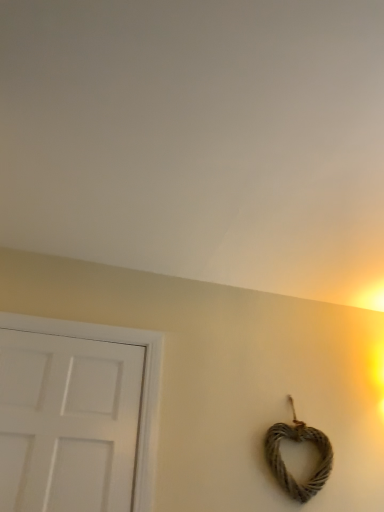
Question: From a real-world perspective, is rustic brown rope heart at lower right beneath white matte door at left?

Choices:
 (A) yes
 (B) no

Answer: (A)

Question: Can you confirm if rustic brown rope heart at lower right is smaller than white matte door at left?

Choices:
 (A) yes
 (B) no

Answer: (A)

Question: From a real-world perspective, is rustic brown rope heart at lower right on white matte door at left?

Choices:
 (A) no
 (B) yes

Answer: (A)

Question: Is rustic brown rope heart at lower right positioned behind white matte door at left?

Choices:
 (A) no
 (B) yes

Answer: (B)

Question: Is rustic brown rope heart at lower right at the left side of white matte door at left?

Choices:
 (A) no
 (B) yes

Answer: (A)

Question: From the image's perspective, is rustic brown rope heart at lower right beneath white matte door at left?

Choices:
 (A) no
 (B) yes

Answer: (B)

Question: Can you confirm if white matte door at left is shorter than rustic brown rope heart at lower right?

Choices:
 (A) no
 (B) yes

Answer: (A)

Question: From a real-world perspective, is white matte door at left located higher than rustic brown rope heart at lower right?

Choices:
 (A) yes
 (B) no

Answer: (A)

Question: From the image's perspective, is white matte door at left located beneath rustic brown rope heart at lower right?

Choices:
 (A) no
 (B) yes

Answer: (A)

Question: Is white matte door at left not within rustic brown rope heart at lower right?

Choices:
 (A) no
 (B) yes

Answer: (B)

Question: Is rustic brown rope heart at lower right located within white matte door at left?

Choices:
 (A) no
 (B) yes

Answer: (A)

Question: Considering the relative sizes of white matte door at left and rustic brown rope heart at lower right in the image provided, is white matte door at left bigger than rustic brown rope heart at lower right?

Choices:
 (A) no
 (B) yes

Answer: (B)

Question: In the image, is rustic brown rope heart at lower right positioned in front of or behind white matte door at left?

Choices:
 (A) behind
 (B) front

Answer: (A)